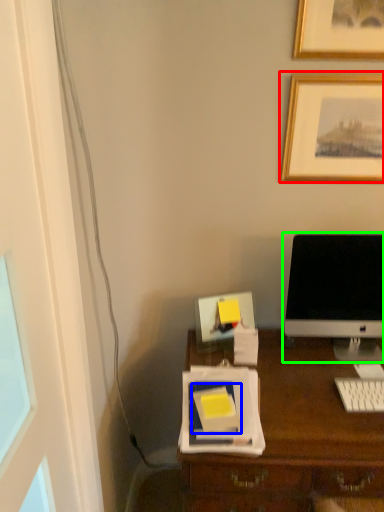
Question: Considering the real-world distances, which object is closest to picture frame (highlighted by a red box)? notebook (highlighted by a blue box) or computer monitor (highlighted by a green box).

Choices:
 (A) notebook
 (B) computer monitor

Answer: (B)